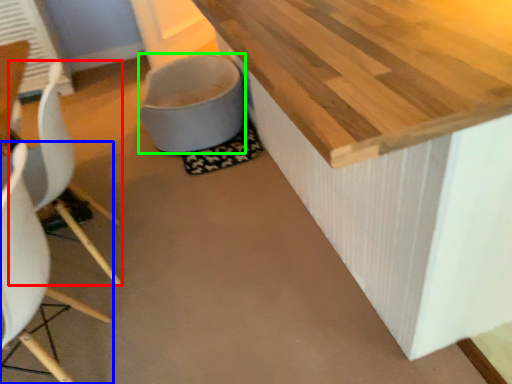
Question: Which object is the farthest from chair (highlighted by a red box)? Choose among these: chair (highlighted by a blue box) or toilet bowl (highlighted by a green box).

Choices:
 (A) chair
 (B) toilet bowl

Answer: (B)